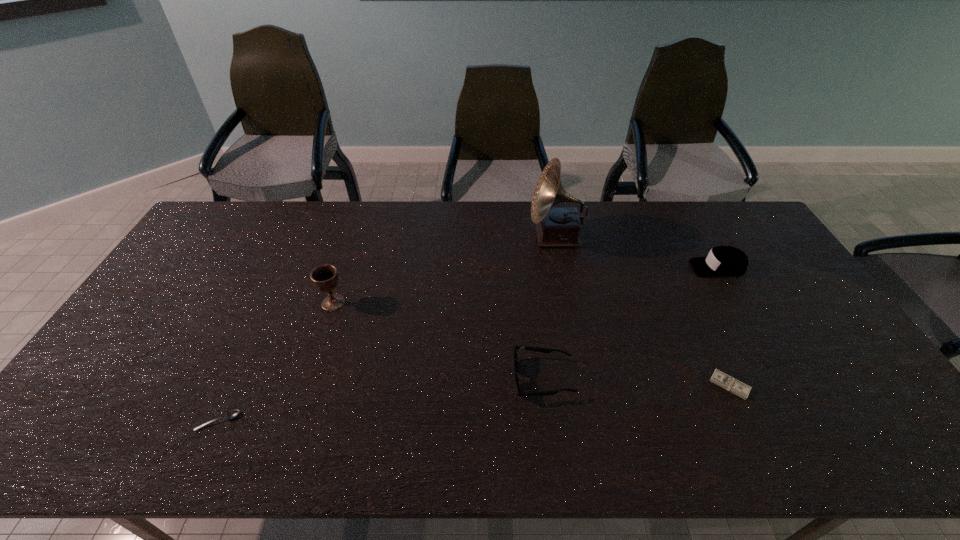
You are a GUI agent. You are given a task and a screenshot of the screen. Output one action in this format:
    pyautogui.click(x=<x>, y=<y>)
    Task: Click on the blank region between the money and the sunglasses
    Image resolution: width=960 pixels, height=540 pixels.
    Given the screenshot: What is the action you would take?
    tap(636, 382)

Where is `vacant region between the fourth shortest object and the second object from right to left`? This screenshot has width=960, height=540. vacant region between the fourth shortest object and the second object from right to left is located at coordinates (724, 326).

Identify the location of vacant space in between the cap and the fifth object from left to right. (724, 326).

You are a GUI agent. You are given a task and a screenshot of the screen. Output one action in this format:
    pyautogui.click(x=<x>, y=<y>)
    Task: Click on the vacant space that is in between the second object from left to right and the tallest object
    This screenshot has width=960, height=540.
    Given the screenshot: What is the action you would take?
    pyautogui.click(x=444, y=270)

Locate an element on the screen. The image size is (960, 540). free space between the cap and the sunglasses is located at coordinates (630, 323).

Find the location of a particular element. The image size is (960, 540). free space between the nearest object and the phonograph record is located at coordinates (387, 329).

Where is `free spot between the rightmost object and the money`? Image resolution: width=960 pixels, height=540 pixels. free spot between the rightmost object and the money is located at coordinates (724, 326).

Find the location of a particular element. The height and width of the screenshot is (540, 960). free space between the shortest object and the third tallest object is located at coordinates (468, 345).

This screenshot has height=540, width=960. I want to click on vacant area that lies between the shortest object and the third shortest object, so click(380, 400).

Where is `object that stands as the fifth closest to the fifth shortest object`? object that stands as the fifth closest to the fifth shortest object is located at coordinates (x=728, y=261).